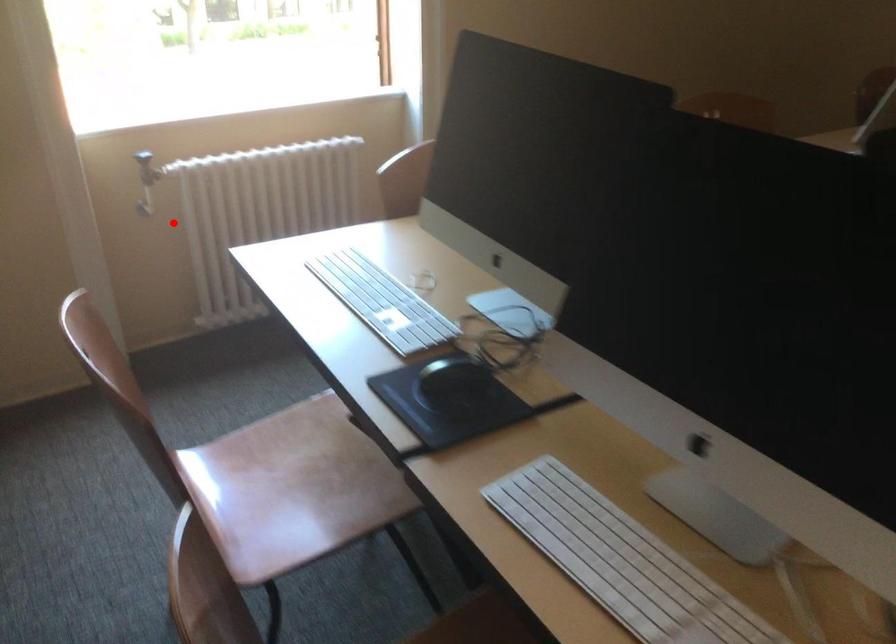
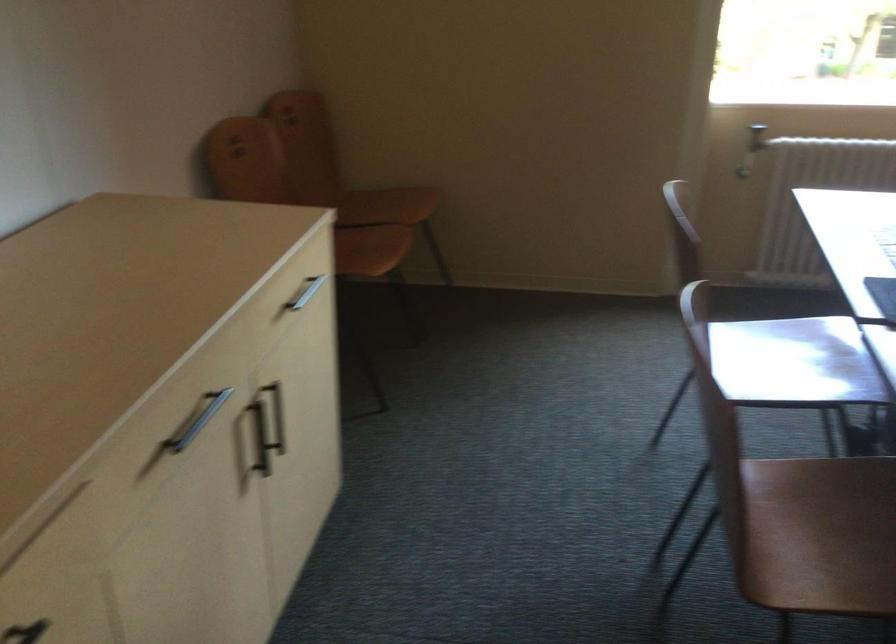
Question: I am providing you with two images of the same scene from different viewpoints. In image1, a red point is highlighted. Considering the same 3D point in image2, which of the following is correct?

Choices:
 (A) It is closer
 (B) It is farther

Answer: (B)